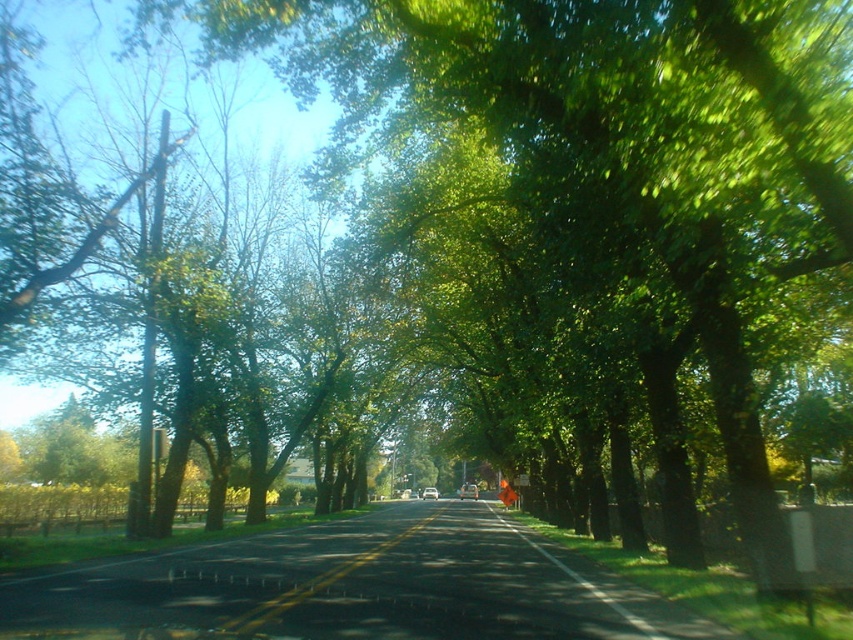
Between yellow asphalt road at center and metallic silver sedan at center, which one is positioned lower?

Positioned lower is metallic silver sedan at center.

Can you confirm if yellow asphalt road at center is bigger than metallic silver sedan at center?

Correct, yellow asphalt road at center is larger in size than metallic silver sedan at center.

Which is behind, point (403, 536) or point (433, 499)?

The point (433, 499) is behind.

Identify the location of yellow asphalt road at center. [315, 584].

Does green leafy tree at center have a greater width compared to metallic silver sedan at center?

Incorrect, green leafy tree at center's width does not surpass metallic silver sedan at center's.

Who is positioned more to the left, green leafy tree at center or metallic silver sedan at center?

metallic silver sedan at center is more to the left.

Find the location of a particular element. This screenshot has height=640, width=853. green leafy tree at center is located at coordinates (587, 584).

Where is `green leafy tree at center`? The image size is (853, 640). green leafy tree at center is located at coordinates (587, 584).

Who is more distant from viewer, (403, 538) or (549, 560)?

Positioned behind is point (403, 538).

Is yellow asphalt road at center thinner than green leafy tree at center?

No, yellow asphalt road at center is not thinner than green leafy tree at center.

Who is more forward, (x=328, y=584) or (x=523, y=538)?

Point (x=328, y=584) is more forward.

Find the location of a particular element. This screenshot has width=853, height=640. yellow asphalt road at center is located at coordinates (315, 584).